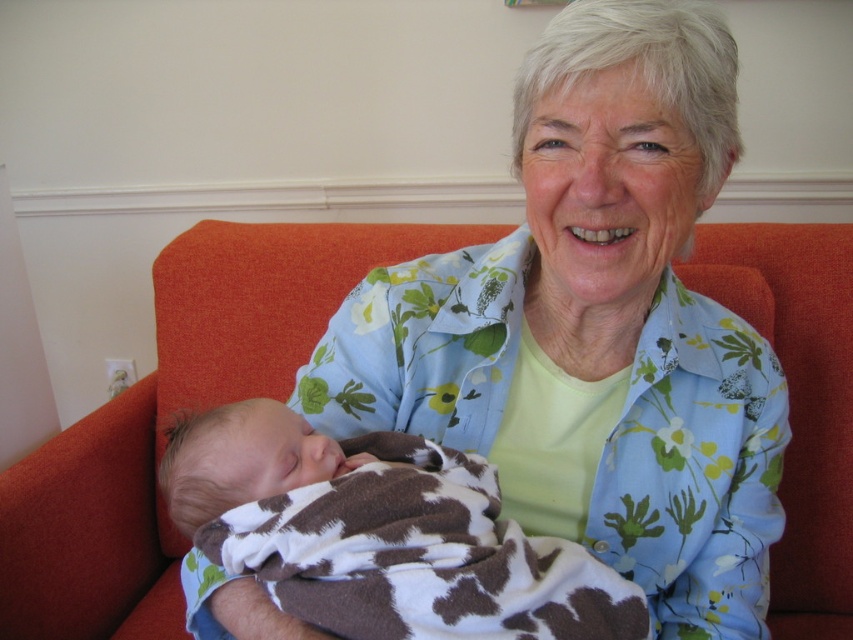
You are a furniture designer evaluating the space requirements for a nursery. You see an orange fabric couch at center and a cowprint fabric newborn at lower left. Which object requires more space in the nursery?

The orange fabric couch at center requires more space in the nursery because it is bigger than the cowprint fabric newborn at lower left.

You are a photographer adjusting your camera settings to focus on the floral shirt at center and the orange fabric couch at center. Which object should you focus on first to ensure proper depth of field?

The floral shirt at center is closer to the viewer than the orange fabric couch at center, so you should focus on the floral shirt at center first to ensure proper depth of field.

You are a photographer setting up for a family portrait. You need to position a reflector to bounce light onto the cowprint fabric newborn at lower left without casting shadows on the orange fabric couch at center. Based on the scene description, where should you place the reflector relative to the newborn?

The cowprint fabric newborn at lower left is behind the orange fabric couch at center. To avoid casting shadows on the couch, the reflector should be placed in front of the newborn, facing towards the light source so that the light reflects onto the newborn without obstructing the couch.